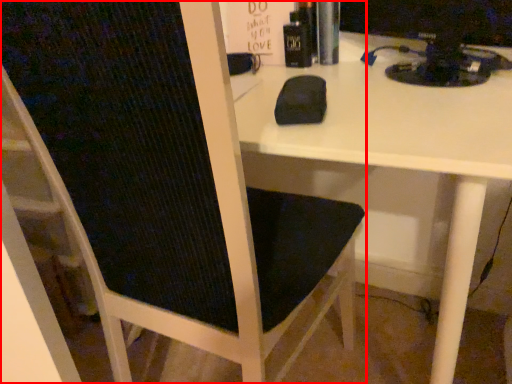
Question: In this image, where is chair (annotated by the red box) located relative to desktop computer?

Choices:
 (A) left
 (B) right

Answer: (A)